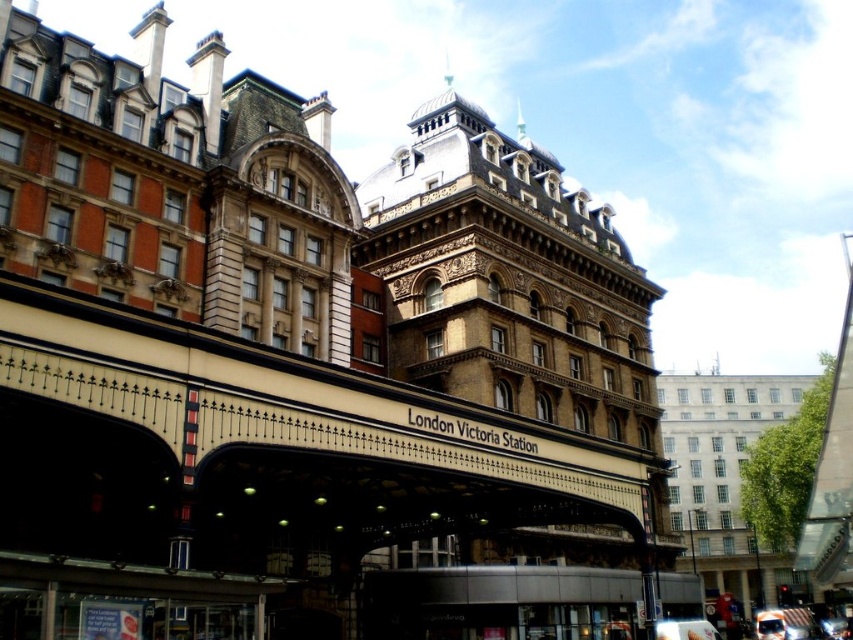
Can you confirm if brown textured awning at center is taller than white glossy van at center?

Yes.

The image size is (853, 640). What do you see at coordinates (308, 432) in the screenshot?
I see `brown textured awning at center` at bounding box center [308, 432].

Where is `brown textured awning at center`? Image resolution: width=853 pixels, height=640 pixels. brown textured awning at center is located at coordinates (308, 432).